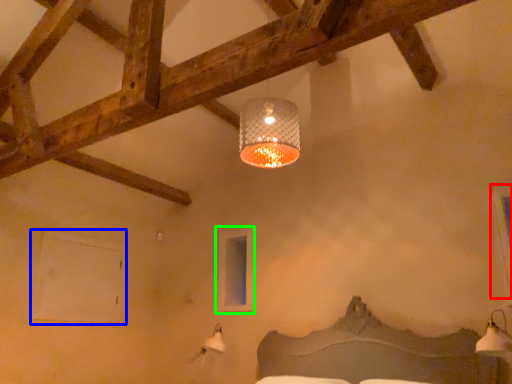
Question: Which object is the closest to the window (highlighted by a red box)? Choose among these: window (highlighted by a blue box) or window (highlighted by a green box).

Choices:
 (A) window
 (B) window

Answer: (B)